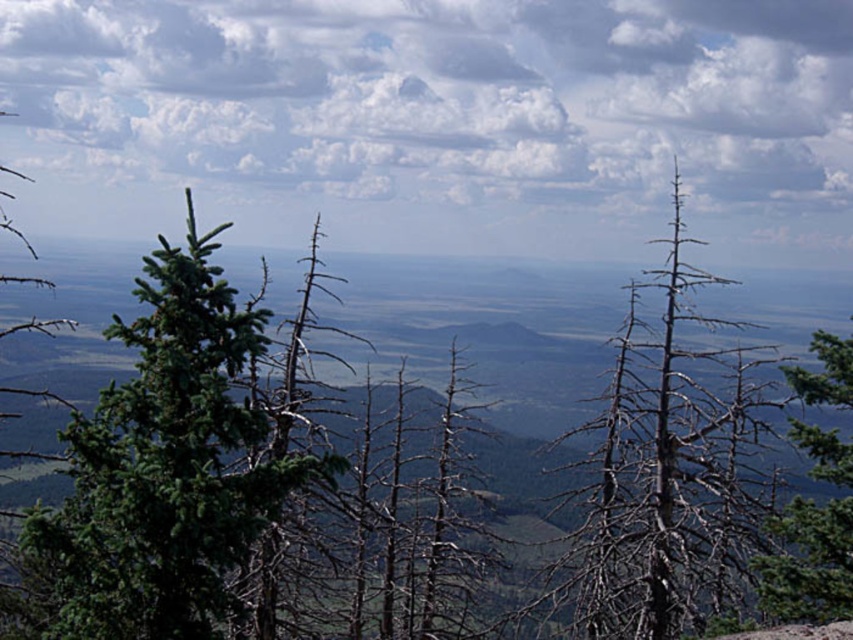
You are a hiker planning to set up a tent in the valley. You need to choose between the green matte evergreen tree at left and the dead wood tree at center for shelter. Which tree has a wider trunk to provide better wind protection?

The dead wood tree at center has a wider trunk than the green matte evergreen tree at left, so it would provide better wind protection.

You are a hiker standing at the base of the dead wood tree at center and the green matte tree at right. Which tree would you need to look up more to see the top of?

The dead wood tree at center has a greater height compared to the green matte tree at right, so you would need to look up more to see the top of the dead wood tree at center.

You are an environmental scientist analyzing the forest composition. You observe the dead wood tree at center and the green matte tree at right. Which tree would you estimate to have a greater height?

The dead wood tree at center has a larger size compared to the green matte tree at right, so it would have a greater height.